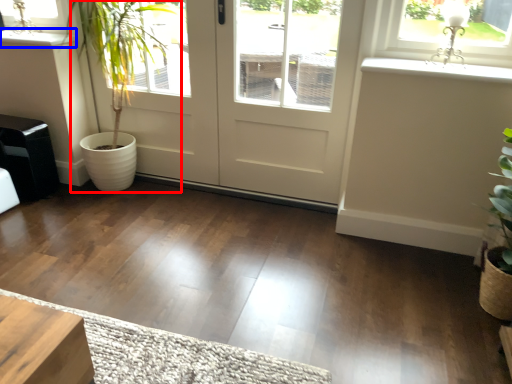
Question: Which point is further to the camera, houseplant (highlighted by a red box) or window sill (highlighted by a blue box)?

Choices:
 (A) houseplant
 (B) window sill

Answer: (B)